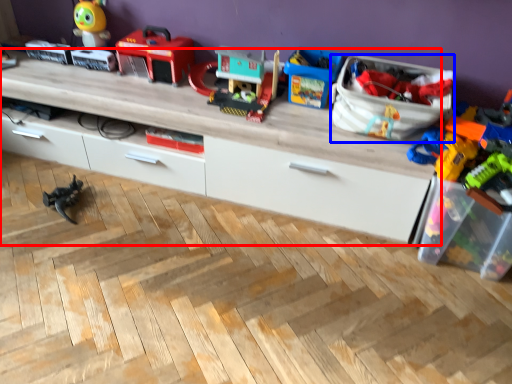
Question: Among these objects, which one is farthest to the camera, entertainment center (highlighted by a red box) or storage box (highlighted by a blue box)?

Choices:
 (A) entertainment center
 (B) storage box

Answer: (A)